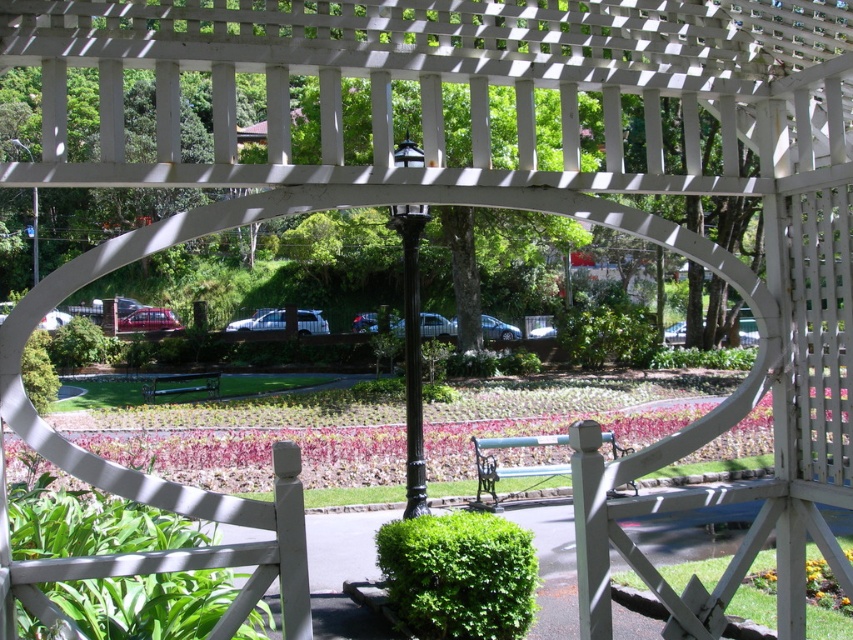
You are a gardener who wants to plant a new flower that needs at least 2 feet of space. You see the pink matte flower at center and the green wooden bench at center. Which object can you place the new flower next to without blocking the view of the other?

The pink matte flower at center is much taller than the green wooden bench at center, so placing the new flower next to the green wooden bench at center would be better to avoid blocking the view of the taller pink matte flower at center.

You are a gardener who wants to plant a new flower that is exactly the same size as the pink matte flower at center. You have a space that can only accommodate an object as big as the green painted wood bench at center. Will the new flower fit?

The pink matte flower at center is larger in size than the green painted wood bench at center. Therefore, the new flower will not fit in the space allocated for the green painted wood bench at center.

You are a gardener who wants to plant a new flower that requires at least 2 feet of space. You see the pink matte flower at center and the green painted wood bench at center. Which object has enough space for the new flower?

The pink matte flower at center has a larger width than the green painted wood bench at center, so it provides enough space for the new flower requiring at least 2 feet of space.